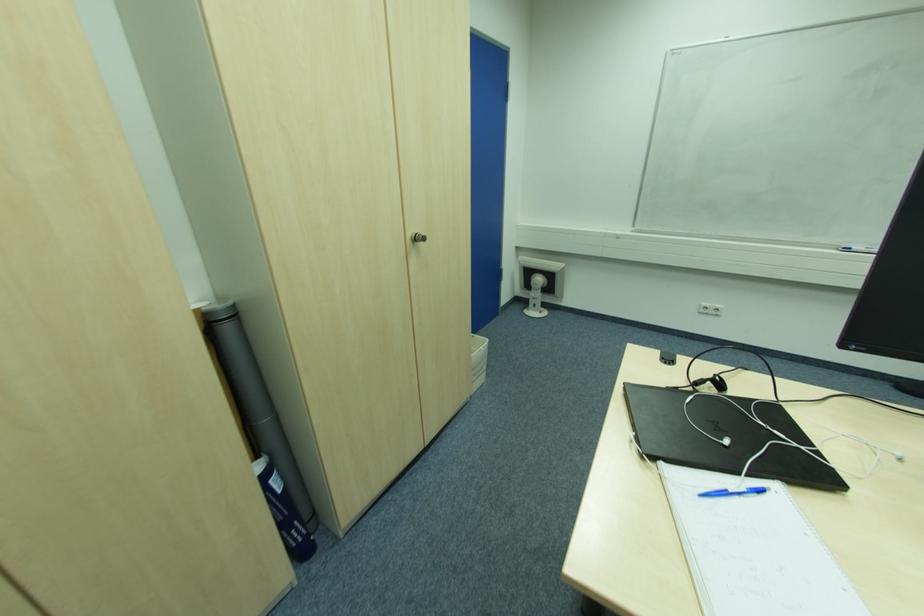
This screenshot has height=616, width=924. What do you see at coordinates (418, 237) in the screenshot? I see `the silver cabinet knob` at bounding box center [418, 237].